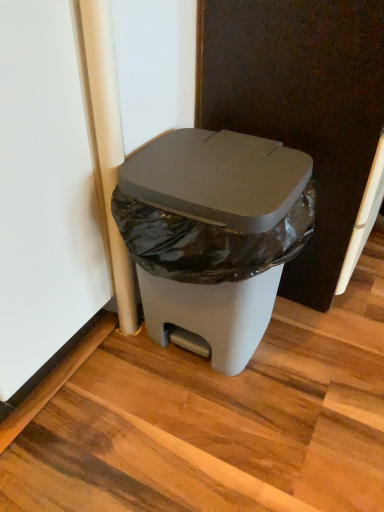
What do you see at coordinates (214, 234) in the screenshot? Image resolution: width=384 pixels, height=512 pixels. I see `matte plastic trash can at lower right` at bounding box center [214, 234].

Locate an element on the screen. matte plastic trash can at lower right is located at coordinates (214, 234).

This screenshot has height=512, width=384. Identify the location of matte plastic trash can at lower right. (214, 234).